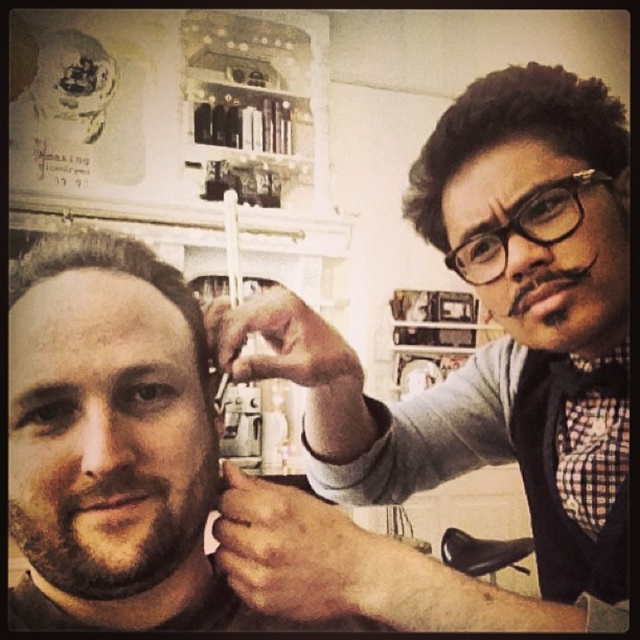
Question: Does black textured hair at upper right appear on the right side of brown matte hair at center?

Choices:
 (A) yes
 (B) no

Answer: (A)

Question: Which object is closer to the camera taking this photo?

Choices:
 (A) brown matte hair at center
 (B) brownroughbeard at left

Answer: (B)

Question: Is brownroughbeard at left to the left of brown matte hair at center from the viewer's perspective?

Choices:
 (A) no
 (B) yes

Answer: (A)

Question: Which object is the farthest from the brownroughbeard at left?

Choices:
 (A) black matte comb at upper right
 (B) black textured hair at upper right
 (C) brown matte hair at center

Answer: (B)

Question: Is black matte comb at upper right thinner than black textured hair at upper right?

Choices:
 (A) yes
 (B) no

Answer: (B)

Question: Which of these objects is positioned farthest from the black textured hair at upper right?

Choices:
 (A) brownroughbeard at left
 (B) black matte comb at upper right

Answer: (A)